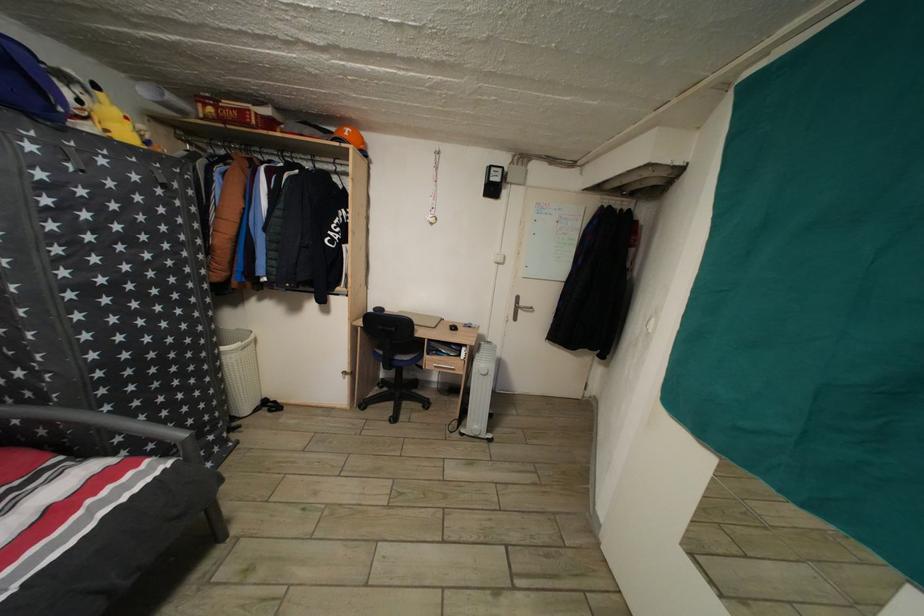
You are a GUI agent. You are given a task and a screenshot of the screen. Output one action in this format:
    pyautogui.click(x=<x>, y=<y>)
    Task: Click on the chair sitting surface
    This screenshot has height=616, width=924.
    Given the screenshot: What is the action you would take?
    pyautogui.click(x=398, y=358)